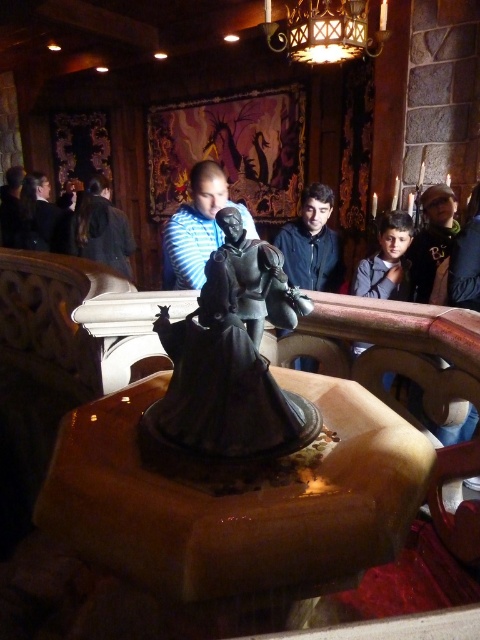
Question: Is shiny bronze statue at center smaller than dark blue shirt at left?

Choices:
 (A) no
 (B) yes

Answer: (B)

Question: Which point is closer to the camera?

Choices:
 (A) (302, 220)
 (B) (303, 3)
 (C) (60, 236)
 (D) (222, 339)

Answer: (D)

Question: Which object appears closest to the camera in this image?

Choices:
 (A) smooth black shirt at center
 (B) shiny bronze statue at center
 (C) striped shirt at center

Answer: (B)

Question: Estimate the real-world distances between objects in this image. Which object is closer to the dark blue shirt at left?

Choices:
 (A) shiny bronze statue at center
 (B) metallic gold chandelier at upper center
 (C) striped shirt at center

Answer: (C)

Question: In this image, where is striped shirt at center located relative to smooth black shirt at center?

Choices:
 (A) right
 (B) left

Answer: (B)

Question: Is metallic gold chandelier at upper center positioned before striped shirt at center?

Choices:
 (A) yes
 (B) no

Answer: (B)